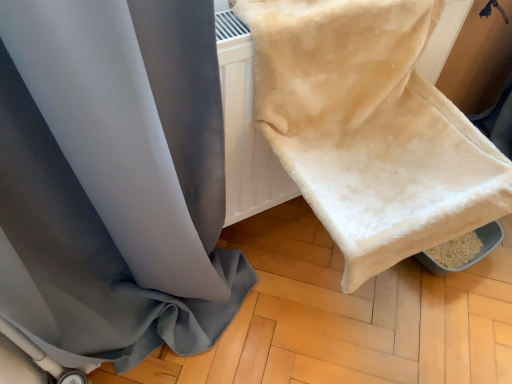
Find the location of a particular element. This screenshot has height=384, width=512. free spot below satin gray curtain at upper left (from a real-world perspective) is located at coordinates (176, 352).